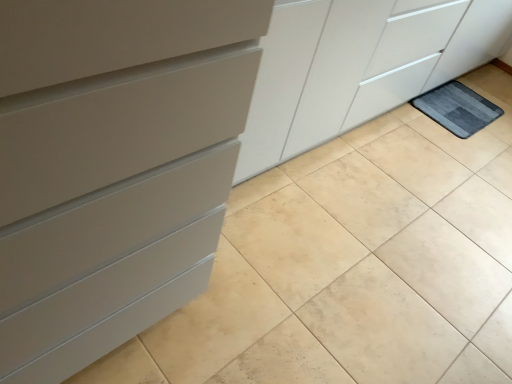
Question: Is matte gray chest of drawers at left positioned in front of gray textured bath mat at lower right?

Choices:
 (A) no
 (B) yes

Answer: (B)

Question: Does matte gray chest of drawers at left appear on the left side of gray textured bath mat at lower right?

Choices:
 (A) yes
 (B) no

Answer: (A)

Question: Is matte gray chest of drawers at left aimed at gray textured bath mat at lower right?

Choices:
 (A) yes
 (B) no

Answer: (B)

Question: Would you say gray textured bath mat at lower right is part of matte gray chest of drawers at left's contents?

Choices:
 (A) no
 (B) yes

Answer: (A)

Question: Can you confirm if matte gray chest of drawers at left is positioned to the right of gray textured bath mat at lower right?

Choices:
 (A) no
 (B) yes

Answer: (A)

Question: Is matte gray chest of drawers at left not inside gray textured bath mat at lower right?

Choices:
 (A) yes
 (B) no

Answer: (A)

Question: Considering the relative positions of gray textured bath mat at lower right and matte gray chest of drawers at left in the image provided, is gray textured bath mat at lower right to the right of matte gray chest of drawers at left from the viewer's perspective?

Choices:
 (A) yes
 (B) no

Answer: (A)

Question: Does gray textured bath mat at lower right have a larger size compared to matte gray chest of drawers at left?

Choices:
 (A) no
 (B) yes

Answer: (A)

Question: Is gray textured bath mat at lower right closer to the viewer compared to matte gray chest of drawers at left?

Choices:
 (A) no
 (B) yes

Answer: (A)

Question: Is gray textured bath mat at lower right positioned beyond the bounds of matte gray chest of drawers at left?

Choices:
 (A) no
 (B) yes

Answer: (B)

Question: From the image's perspective, is gray textured bath mat at lower right located above matte gray chest of drawers at left?

Choices:
 (A) no
 (B) yes

Answer: (B)

Question: Is gray textured bath mat at lower right facing towards matte gray chest of drawers at left?

Choices:
 (A) yes
 (B) no

Answer: (B)

Question: Considering the positions of point (481, 99) and point (97, 137), is point (481, 99) closer or farther from the camera than point (97, 137)?

Choices:
 (A) farther
 (B) closer

Answer: (A)